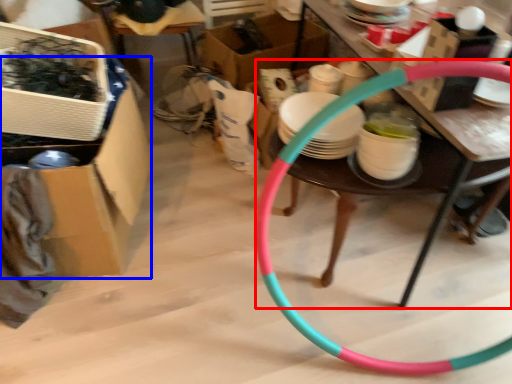
Question: Which of the following is the farthest to the observer, table (highlighted by a red box) or box (highlighted by a blue box)?

Choices:
 (A) table
 (B) box

Answer: (B)